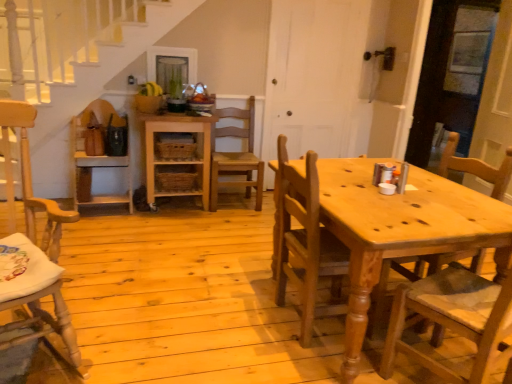
Question: Is natural wood chair at center, which appears as the second chair when viewed from the right, directly adjacent to wooden chair at right, marked as the first chair in a right-to-left arrangement?

Choices:
 (A) no
 (B) yes

Answer: (A)

Question: Is natural wood chair at center, which appears as the second chair when viewed from the right, at the right side of wooden chair at right, marked as the first chair in a right-to-left arrangement?

Choices:
 (A) yes
 (B) no

Answer: (B)

Question: Is natural wood chair at center, the 4th chair from the left, wider than wooden chair at right, marked as the first chair in a right-to-left arrangement?

Choices:
 (A) no
 (B) yes

Answer: (A)

Question: Is natural wood chair at center, which appears as the second chair when viewed from the right, further to camera compared to wooden chair at right, marked as the first chair in a right-to-left arrangement?

Choices:
 (A) yes
 (B) no

Answer: (A)

Question: Is natural wood chair at center, the 4th chair from the left, closer to the viewer compared to wooden chair at right, acting as the fifth chair starting from the left?

Choices:
 (A) yes
 (B) no

Answer: (B)

Question: Looking at their shapes, would you say natural wood chair at center, which appears as the second chair when viewed from the right, is wider or thinner than wooden chair at center, arranged as the 3th chair when viewed from the left?

Choices:
 (A) wide
 (B) thin

Answer: (B)

Question: Considering the positions of point tap(322, 233) and point tap(233, 110), is point tap(322, 233) closer or farther from the camera than point tap(233, 110)?

Choices:
 (A) closer
 (B) farther

Answer: (A)

Question: Considering the positions of natural wood chair at center, which appears as the second chair when viewed from the right, and wooden chair at center, the 3th chair viewed from the right, in the image, is natural wood chair at center, which appears as the second chair when viewed from the right, taller or shorter than wooden chair at center, the 3th chair viewed from the right,?

Choices:
 (A) tall
 (B) short

Answer: (B)

Question: In the image, is natural wood chair at center, which appears as the second chair when viewed from the right, on the left side or the right side of wooden chair at center, arranged as the 3th chair when viewed from the left?

Choices:
 (A) right
 (B) left

Answer: (A)

Question: In the image, is natural wood shelf at center on the left side or the right side of natural wood chair at center, which appears as the second chair when viewed from the right?

Choices:
 (A) left
 (B) right

Answer: (A)

Question: From a real-world perspective, is natural wood shelf at center physically located above or below natural wood chair at center, which appears as the second chair when viewed from the right?

Choices:
 (A) above
 (B) below

Answer: (B)

Question: Is natural wood shelf at center inside the boundaries of natural wood chair at center, which appears as the second chair when viewed from the right, or outside?

Choices:
 (A) inside
 (B) outside

Answer: (B)

Question: Based on their sizes in the image, would you say natural wood shelf at center is bigger or smaller than natural wood chair at center, which appears as the second chair when viewed from the right?

Choices:
 (A) small
 (B) big

Answer: (B)

Question: Considering the positions of point (25, 167) and point (284, 281), is point (25, 167) closer or farther from the camera than point (284, 281)?

Choices:
 (A) farther
 (B) closer

Answer: (A)

Question: From a real-world perspective, relative to natural wood chair at center, which appears as the second chair when viewed from the right, is light brown wood chair at left, marked as the 2th chair in a left-to-right arrangement, vertically above or below?

Choices:
 (A) above
 (B) below

Answer: (A)